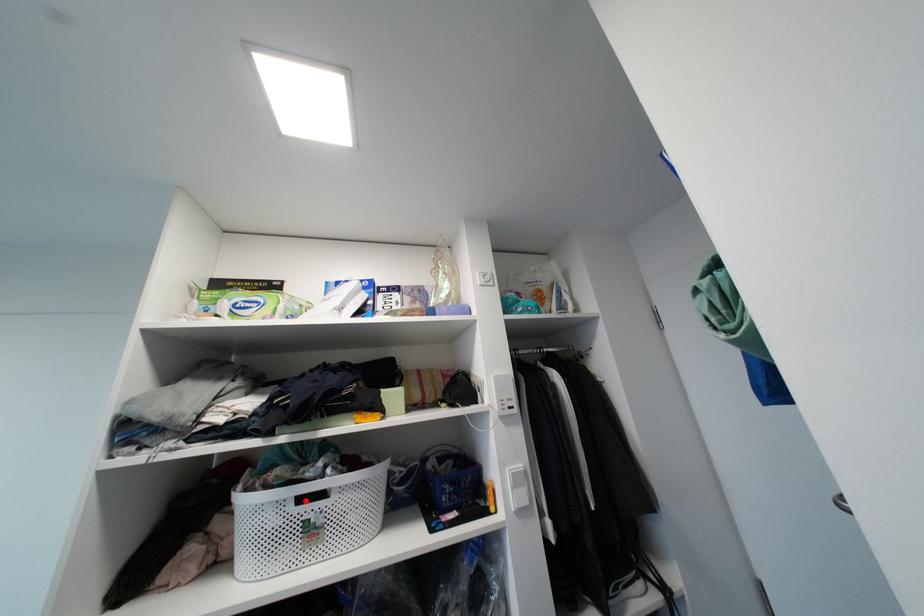
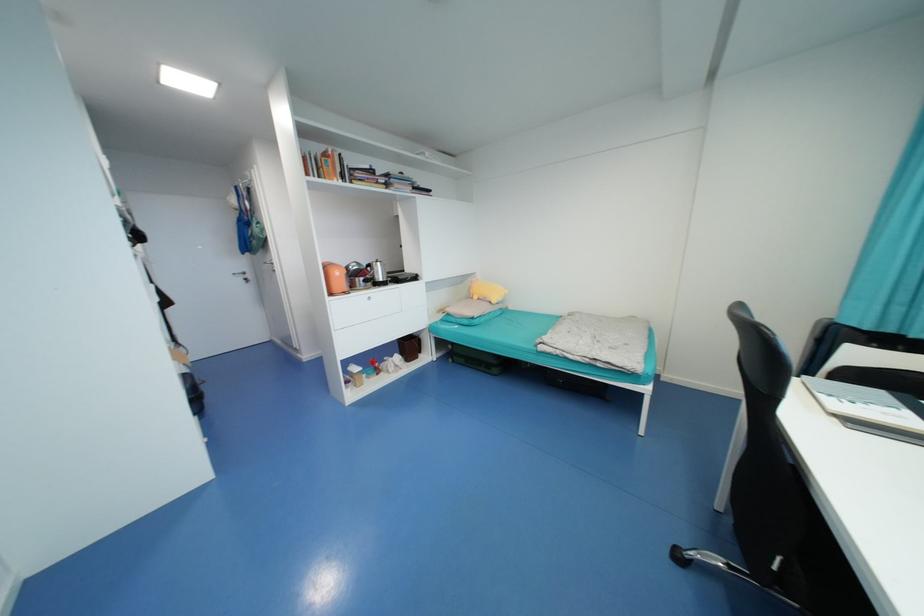
Question: I am providing you with two images of the same scene from different viewpoints. A red point is marked on the first image. Can you still see the location of the red point in image 2?

Choices:
 (A) Yes
 (B) No

Answer: (B)